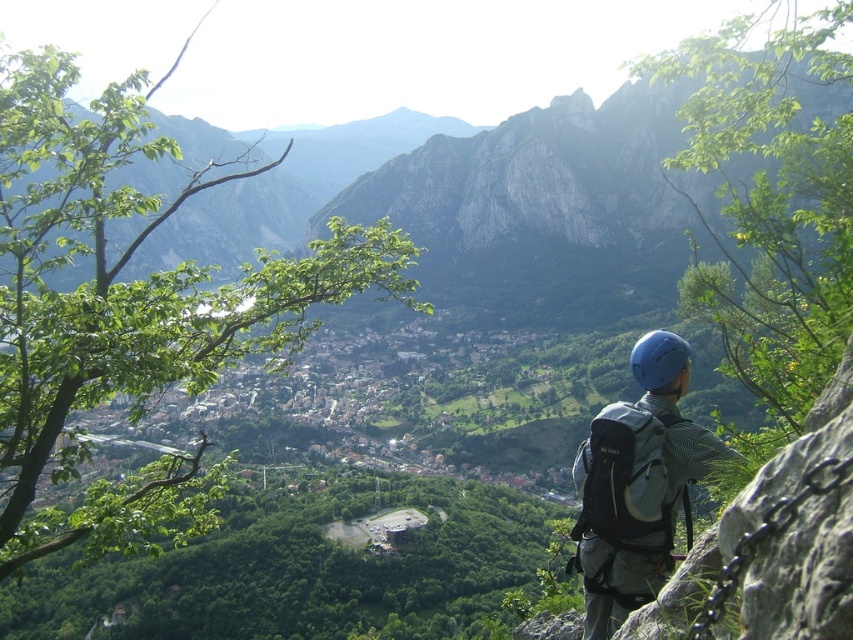
Between matte gray backpack at center right and blue matte helmet at center, which one has less height?

blue matte helmet at center

At what (x,y) coordinates should I click in order to perform the action: click on matte gray backpack at center right. Please return your answer as a coordinate pair (x, y). The height and width of the screenshot is (640, 853). Looking at the image, I should click on (640, 484).

I want to click on matte gray backpack at center right, so click(x=640, y=484).